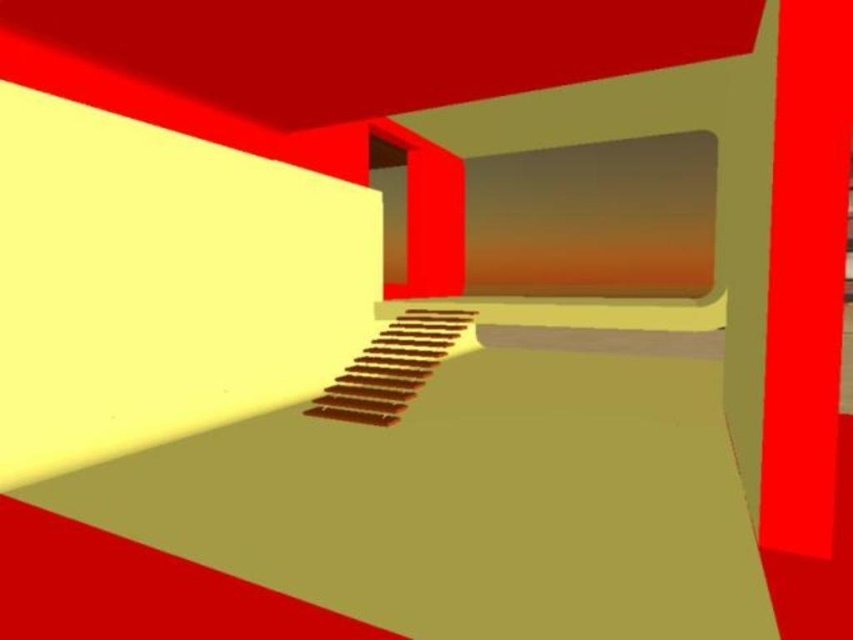
Question: Among these points, which one is nearest to the camera?

Choices:
 (A) (379, 396)
 (B) (809, 397)

Answer: (B)

Question: Which object appears closest to the camera in this image?

Choices:
 (A) smooth glossy red pillar at right
 (B) wooden stairs at center

Answer: (A)

Question: Can you confirm if smooth glossy red pillar at right is positioned to the right of wooden stairs at center?

Choices:
 (A) yes
 (B) no

Answer: (A)

Question: Can you confirm if smooth glossy red pillar at right is positioned to the left of wooden stairs at center?

Choices:
 (A) no
 (B) yes

Answer: (A)

Question: Can you confirm if smooth glossy red pillar at right is positioned to the right of wooden stairs at center?

Choices:
 (A) no
 (B) yes

Answer: (B)

Question: Which of the following is the farthest from the observer?

Choices:
 (A) (827, 19)
 (B) (410, 387)

Answer: (B)